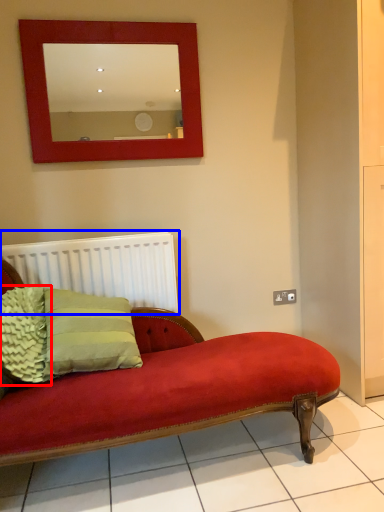
Question: Which object is closer to the camera taking this photo, pillow (highlighted by a red box) or radiator (highlighted by a blue box)?

Choices:
 (A) pillow
 (B) radiator

Answer: (A)